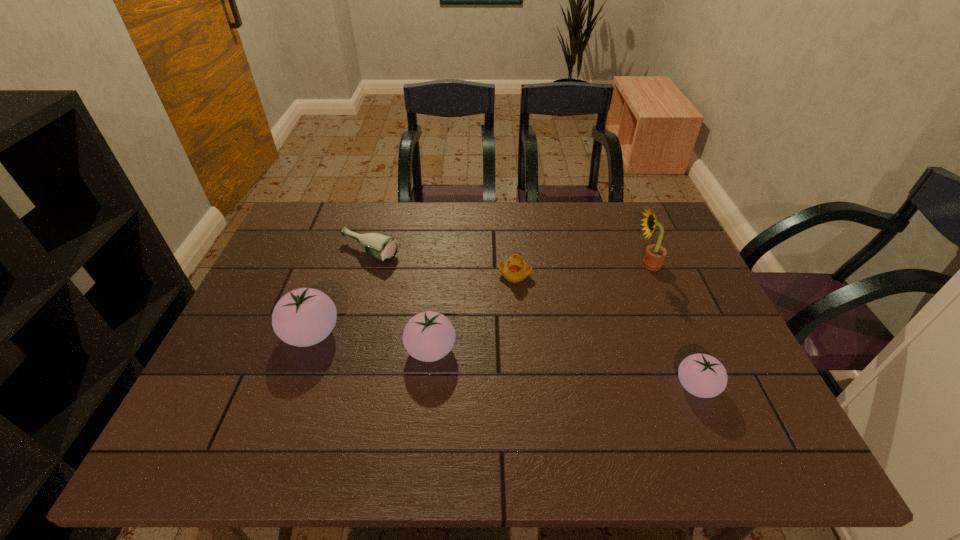
The height and width of the screenshot is (540, 960). I want to click on free space at the near right corner, so click(x=739, y=414).

What are the coordinates of `vacant area that lies between the bottle and the tallest object` in the screenshot? It's located at (508, 258).

Locate an element on the screen. The image size is (960, 540). free space between the third tallest object and the fourth tallest object is located at coordinates (564, 368).

The image size is (960, 540). I want to click on unoccupied area between the second tomato from right to left and the tallest tomato, so click(372, 342).

Identify the location of free spot between the tallest tomato and the sunflower. (479, 299).

Locate an element on the screen. The width and height of the screenshot is (960, 540). free point between the bottle and the tallest tomato is located at coordinates (340, 293).

Where is `empty space between the bottle and the fourth tallest object`? empty space between the bottle and the fourth tallest object is located at coordinates (533, 319).

Locate an element on the screen. This screenshot has width=960, height=540. unoccupied area between the leftmost tomato and the third tallest object is located at coordinates pyautogui.click(x=372, y=342).

At what (x,y) coordinates should I click in order to perform the action: click on empty space that is in between the leftmost tomato and the fourth object from left to right. Please return your answer as a coordinate pair (x, y). The width and height of the screenshot is (960, 540). Looking at the image, I should click on (413, 303).

Identify the location of vacant area between the bottle and the second tomato from right to left. (400, 301).